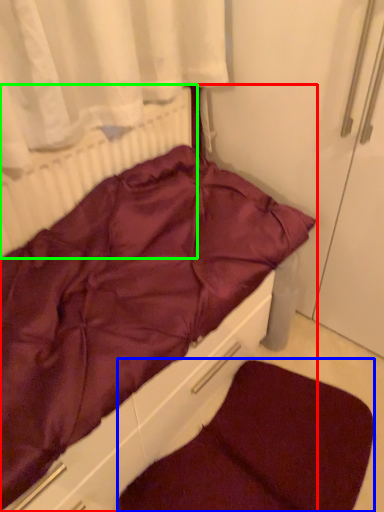
Question: Which object is the closest to the furniture (highlighted by a red box)? Choose among these: dog bed (highlighted by a blue box) or radiator (highlighted by a green box).

Choices:
 (A) dog bed
 (B) radiator

Answer: (B)